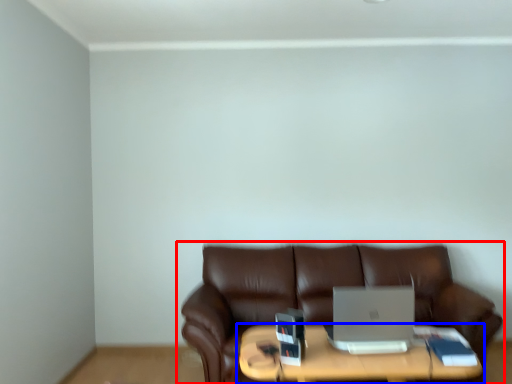
Question: Which object is closer to the camera taking this photo, studio couch (highlighted by a red box) or table (highlighted by a blue box)?

Choices:
 (A) studio couch
 (B) table

Answer: (B)